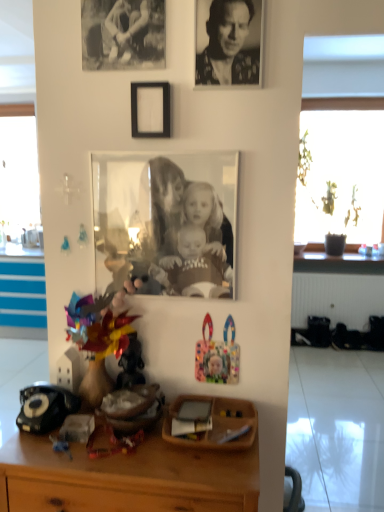
This screenshot has height=512, width=384. Find the location of `vacant area that is in front of shiny metallic toy at center, acting as the first toy starting from the left`. vacant area that is in front of shiny metallic toy at center, acting as the first toy starting from the left is located at coordinates coord(95,454).